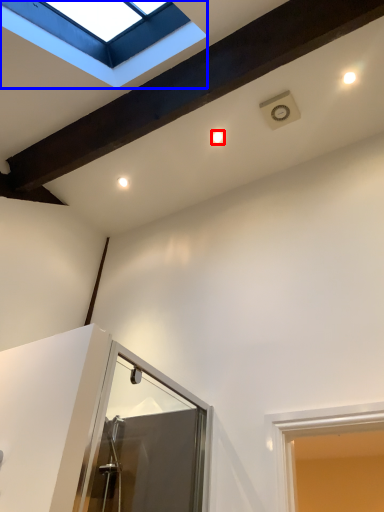
Question: Which of the following is the closest to the observer, droplight (highlighted by a red box) or window (highlighted by a blue box)?

Choices:
 (A) droplight
 (B) window

Answer: (B)